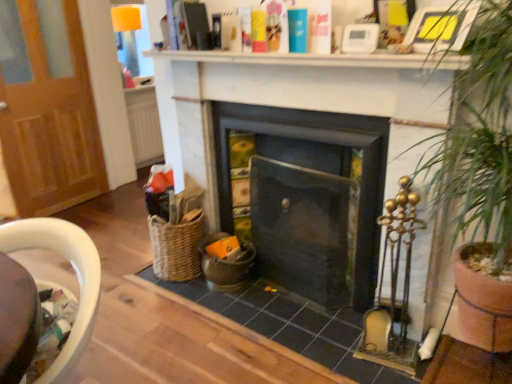
Question: Is woven wicker chair at lower left turned away from dark gray stone fireplace at center, the second fireplace when ordered from left to right?

Choices:
 (A) no
 (B) yes

Answer: (B)

Question: Is woven wicker chair at lower left at the left side of dark gray stone fireplace at center, the second fireplace when ordered from left to right?

Choices:
 (A) no
 (B) yes

Answer: (B)

Question: Is woven wicker chair at lower left located outside dark gray stone fireplace at center, the 1th fireplace in the right-to-left sequence?

Choices:
 (A) yes
 (B) no

Answer: (A)

Question: Considering the relative sizes of woven wicker chair at lower left and dark gray stone fireplace at center, the 1th fireplace in the right-to-left sequence, in the image provided, is woven wicker chair at lower left bigger than dark gray stone fireplace at center, the 1th fireplace in the right-to-left sequence,?

Choices:
 (A) yes
 (B) no

Answer: (B)

Question: Is woven wicker chair at lower left shorter than dark gray stone fireplace at center, the second fireplace when ordered from left to right?

Choices:
 (A) no
 (B) yes

Answer: (B)

Question: From their relative heights in the image, would you say woven wicker chair at lower left is taller or shorter than yellow paper picture frame at upper right?

Choices:
 (A) short
 (B) tall

Answer: (B)

Question: Would you say woven wicker chair at lower left is inside or outside yellow paper picture frame at upper right?

Choices:
 (A) outside
 (B) inside

Answer: (A)

Question: Based on their positions, is woven wicker chair at lower left located to the left or right of yellow paper picture frame at upper right?

Choices:
 (A) right
 (B) left

Answer: (B)

Question: Is woven wicker chair at lower left wider or thinner than yellow paper picture frame at upper right?

Choices:
 (A) wide
 (B) thin

Answer: (A)

Question: In terms of height, does yellow paper picture frame at upper right look taller or shorter compared to matte black fireplace at center, arranged as the first fireplace when viewed from the left?

Choices:
 (A) tall
 (B) short

Answer: (B)

Question: Is yellow paper picture frame at upper right in front of or behind matte black fireplace at center, acting as the 2th fireplace starting from the right, in the image?

Choices:
 (A) front
 (B) behind

Answer: (A)

Question: From the image's perspective, is yellow paper picture frame at upper right located above or below matte black fireplace at center, acting as the 2th fireplace starting from the right?

Choices:
 (A) below
 (B) above

Answer: (B)

Question: From a real-world perspective, relative to matte black fireplace at center, acting as the 2th fireplace starting from the right, is yellow paper picture frame at upper right vertically above or below?

Choices:
 (A) above
 (B) below

Answer: (A)

Question: Considering the positions of yellow paper picture frame at upper right and white matte shelf at upper center in the image, is yellow paper picture frame at upper right taller or shorter than white matte shelf at upper center?

Choices:
 (A) tall
 (B) short

Answer: (A)

Question: Looking at the image, does yellow paper picture frame at upper right seem bigger or smaller compared to white matte shelf at upper center?

Choices:
 (A) small
 (B) big

Answer: (A)